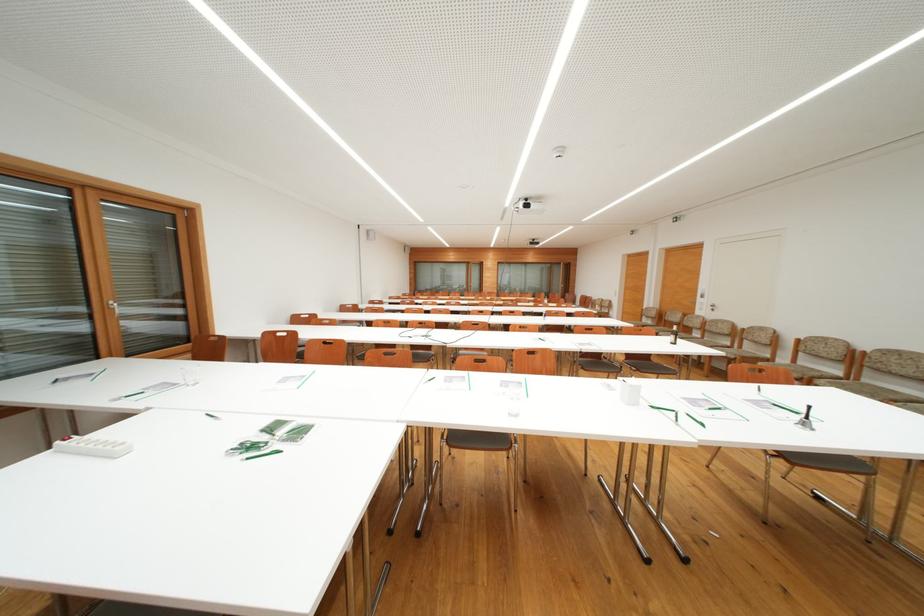
What do you see at coordinates (674, 334) in the screenshot?
I see `the small service bell` at bounding box center [674, 334].